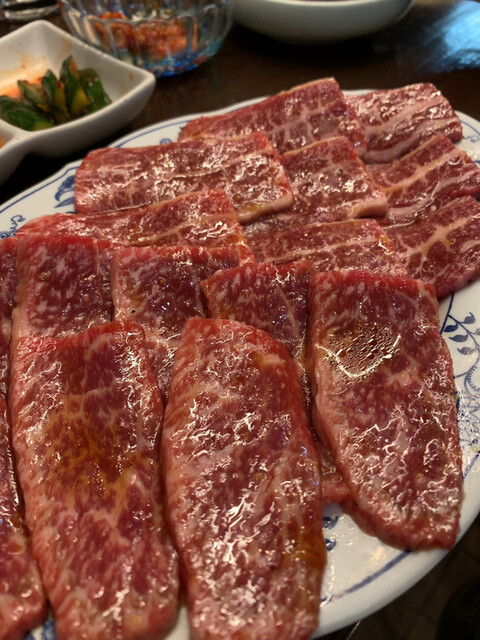
Where is `white bowl`? This screenshot has height=640, width=480. white bowl is located at coordinates (320, 19).